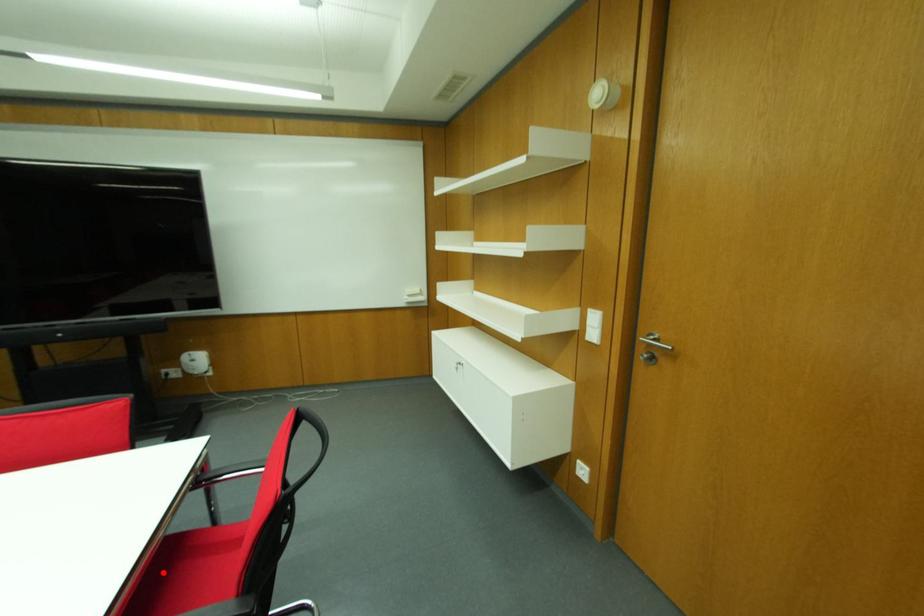
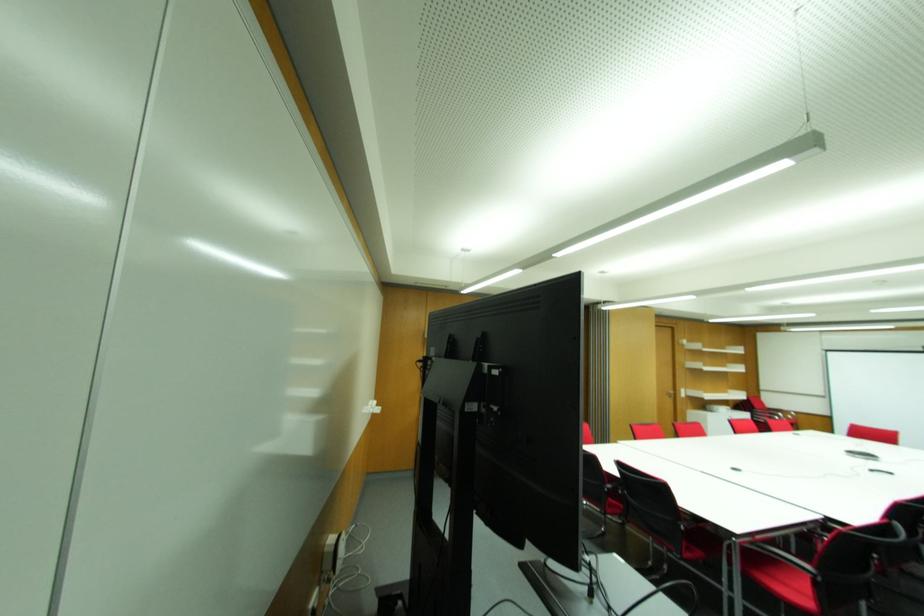
Question: I am providing you with two images of the same scene from different viewpoints. A red point is marked on the first image. Is the red point's position out of view in image 2?

Choices:
 (A) Yes
 (B) No

Answer: (A)